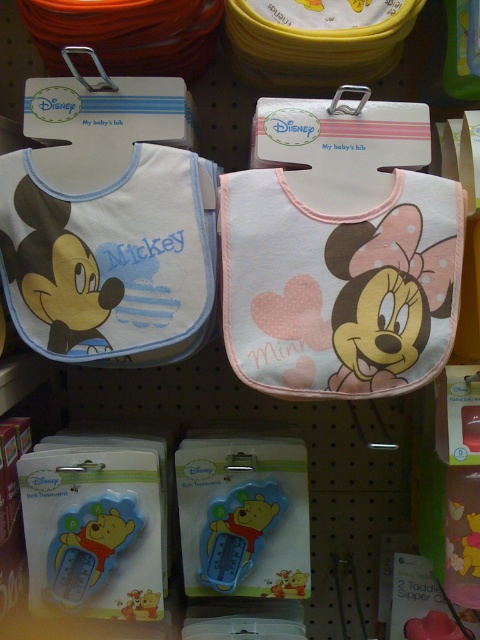
Question: Estimate the real-world distances between objects in this image. Which object is closer to the pastel pink fabric minnie mouse bib at center?

Choices:
 (A) matte white bib at center
 (B) blue rubber thermometer at lower left

Answer: (A)

Question: Which of the following is the closest to the observer?

Choices:
 (A) blue rubber thermometer at center
 (B) blue rubber thermometer at lower left
 (C) matte white bib at center
 (D) pastel pink fabric minnie mouse bib at center

Answer: (D)

Question: Can you confirm if blue rubber thermometer at lower left is positioned below blue rubber thermometer at center?

Choices:
 (A) no
 (B) yes

Answer: (B)

Question: Does blue rubber thermometer at lower left have a smaller size compared to blue rubber thermometer at center?

Choices:
 (A) yes
 (B) no

Answer: (B)

Question: Is matte white bib at center positioned at the back of blue rubber thermometer at center?

Choices:
 (A) yes
 (B) no

Answer: (B)

Question: Among these points, which one is farthest from the camera?

Choices:
 (A) click(x=264, y=524)
 (B) click(x=100, y=506)
 (C) click(x=105, y=346)

Answer: (A)